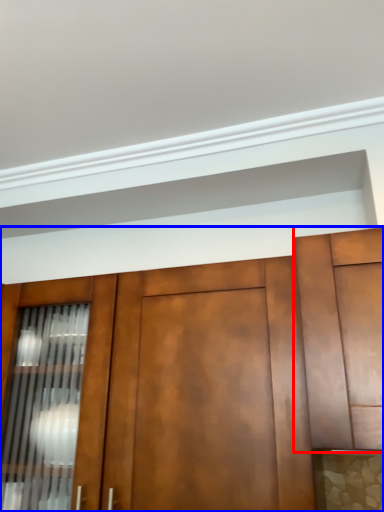
Question: Which point is further to the camera, cabinetry (highlighted by a red box) or cabinetry (highlighted by a blue box)?

Choices:
 (A) cabinetry
 (B) cabinetry

Answer: (B)